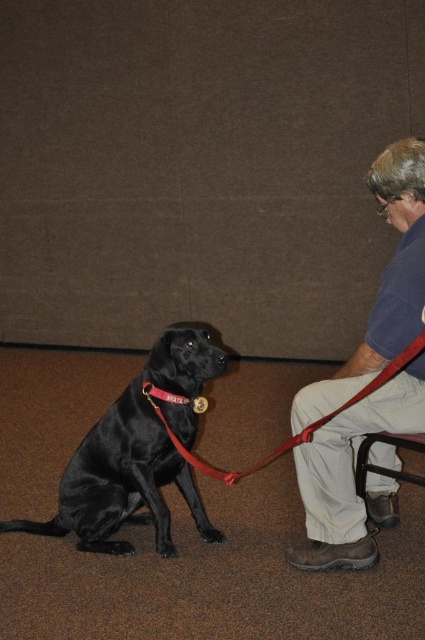
Which is more to the left, shiny black dog at center or red nylon leash at lower left?

From the viewer's perspective, shiny black dog at center appears more on the left side.

Can you confirm if shiny black dog at center is shorter than red nylon leash at lower left?

In fact, shiny black dog at center may be taller than red nylon leash at lower left.

Does point (158, 429) lie in front of point (263, 464)?

No, it is behind (263, 464).

Identify the location of shiny black dog at center. (135, 456).

Is blue cotton shirt at right positioned in front of red nylon leash at lower left?

No, blue cotton shirt at right is behind red nylon leash at lower left.

Who is taller, blue cotton shirt at right or red nylon leash at lower left?

With more height is blue cotton shirt at right.

Is point (407, 218) positioned in front of point (306, 426)?

No, it is behind (306, 426).

At what (x,y) coordinates should I click in order to perform the action: click on blue cotton shirt at right. Please return your answer as a coordinate pair (x, y). The height and width of the screenshot is (640, 425). Looking at the image, I should click on (353, 476).

Can you confirm if red nylon leash at lower left is bigger than metallic gold dog collar at center?

Indeed, red nylon leash at lower left has a larger size compared to metallic gold dog collar at center.

Find the location of a particular element. red nylon leash at lower left is located at coordinates click(303, 428).